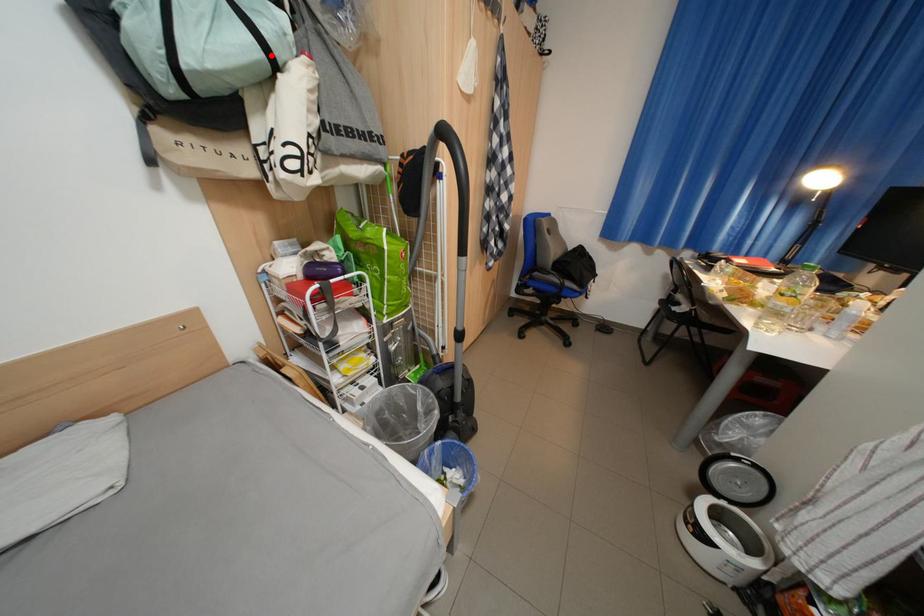
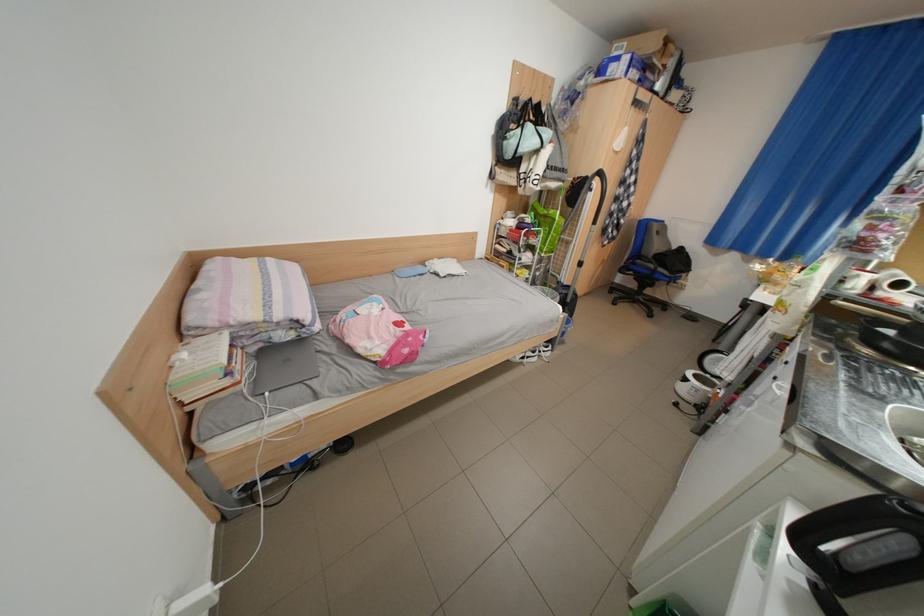
Question: I am providing you with two images of the same scene from different viewpoints. In image1, a red point is highlighted. Considering the same 3D point in image2, which of the following is correct?

Choices:
 (A) It is closer
 (B) It is farther

Answer: (A)